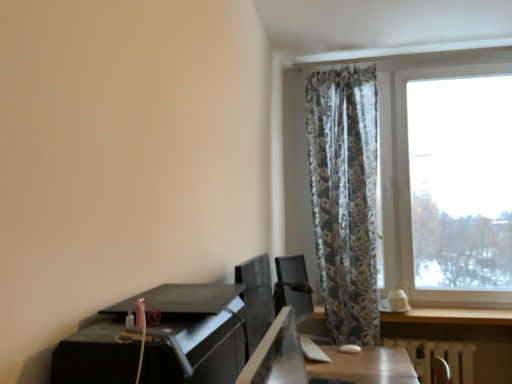
Identify the location of blank space situated above black glossy desk at lower left (from a real-world perspective). click(173, 291).